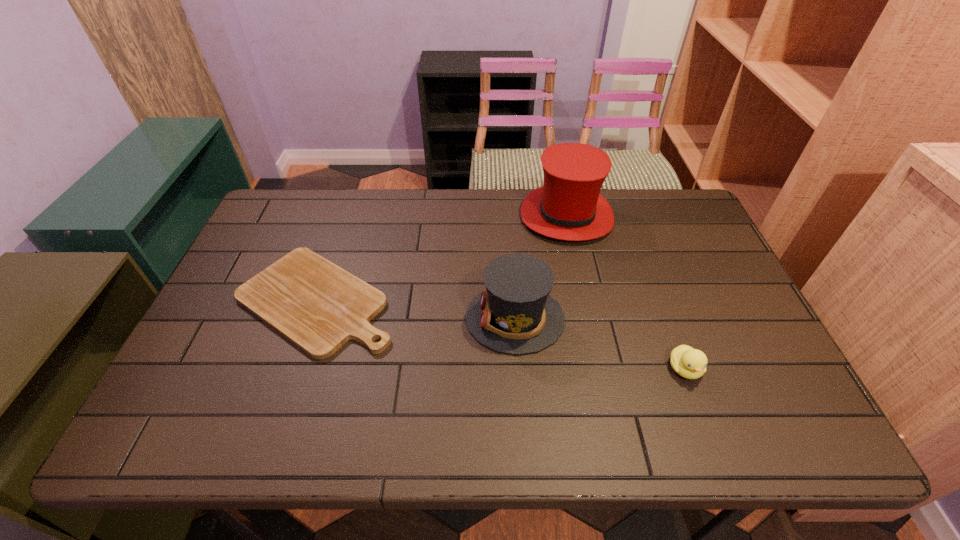
The image size is (960, 540). I want to click on free region located 0.120m with goggles on the front of the nearer dress hat, so click(x=420, y=318).

Image resolution: width=960 pixels, height=540 pixels. Identify the location of free space located 0.170m with goggles on the front of the nearer dress hat. (400, 318).

I want to click on vacant space located at the beak of the second shortest object, so click(x=705, y=423).

At what (x,y) coordinates should I click in order to perform the action: click on vacant region located on the back of the chopping board. Please return your answer as a coordinate pair (x, y). Looking at the image, I should click on (347, 212).

This screenshot has width=960, height=540. I want to click on object present at the far edge, so click(x=569, y=206).

At what (x,y) coordinates should I click in order to perform the action: click on object located in the left edge section of the desktop. Please return your answer as a coordinate pair (x, y). Looking at the image, I should click on (317, 305).

Identify the location of vacant space at the far edge of the desktop. (341, 228).

I want to click on blank area at the near edge, so click(x=685, y=413).

This screenshot has height=540, width=960. What are the coordinates of `free location at the left edge of the desktop` in the screenshot? It's located at (218, 382).

This screenshot has width=960, height=540. I want to click on free space at the right edge of the desktop, so point(688,273).